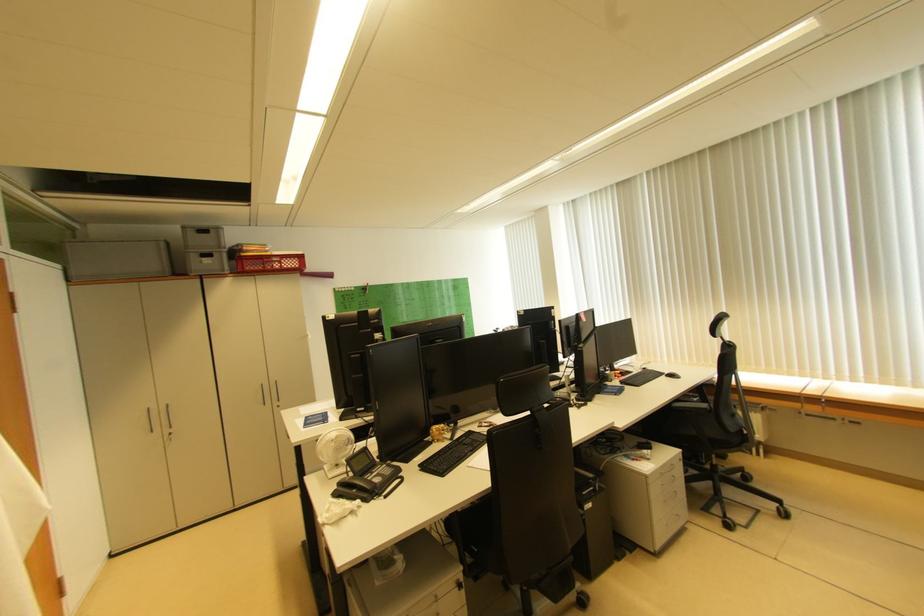
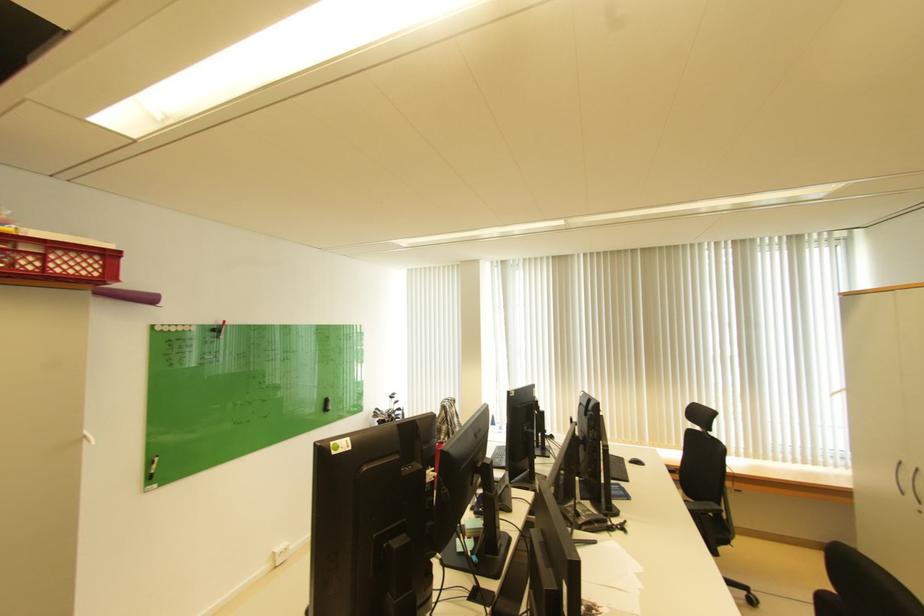
The point at (675, 375) is marked in the first image. Where is the corresponding point in the second image?

(638, 461)